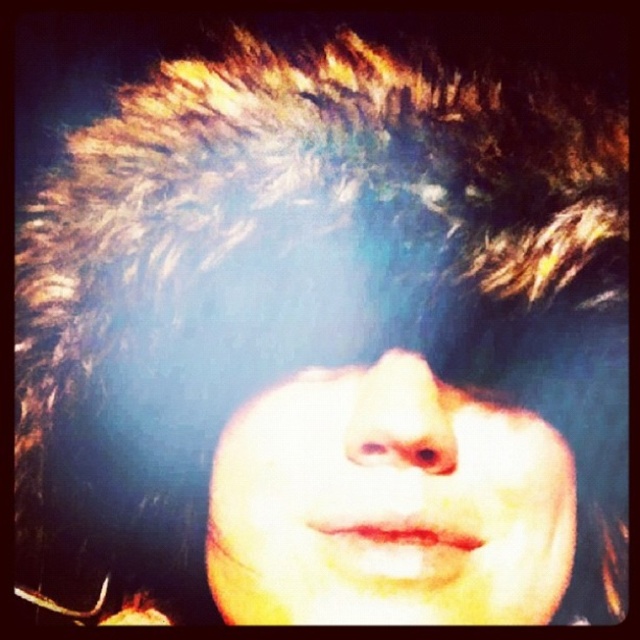
Between point (305, 588) and point (298, 381), which one is positioned in front?

Point (305, 588) is more forward.

Can you confirm if smooth skin face at center is positioned below brown matte eye at center?

Correct, smooth skin face at center is located below brown matte eye at center.

Who is more distant from viewer, (410, 593) or (342, 369)?

Positioned behind is point (342, 369).

Find the location of `smooth skin face at center`. smooth skin face at center is located at coordinates click(x=388, y=506).